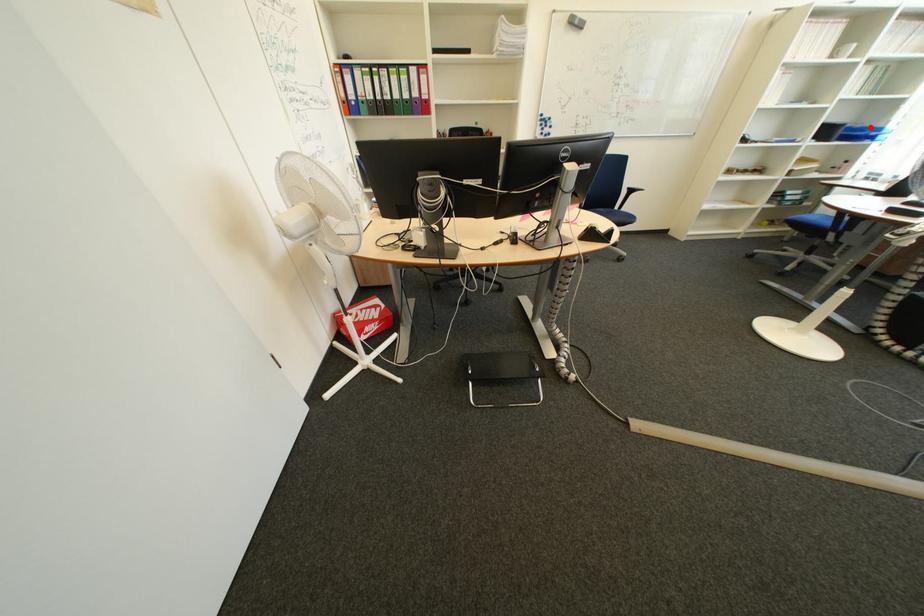
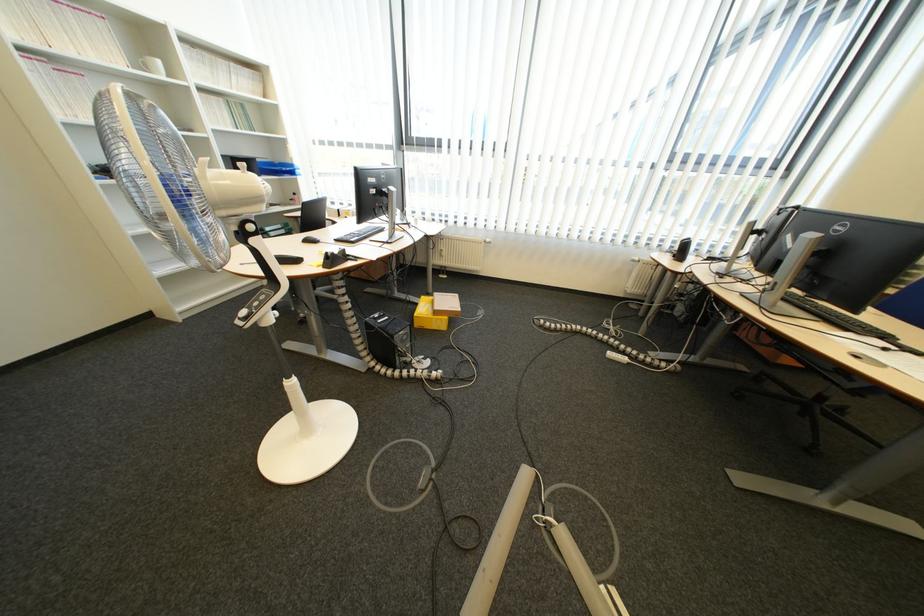
Where in the second image is the point corresponding to the highlighted location from the first image?

(289, 163)